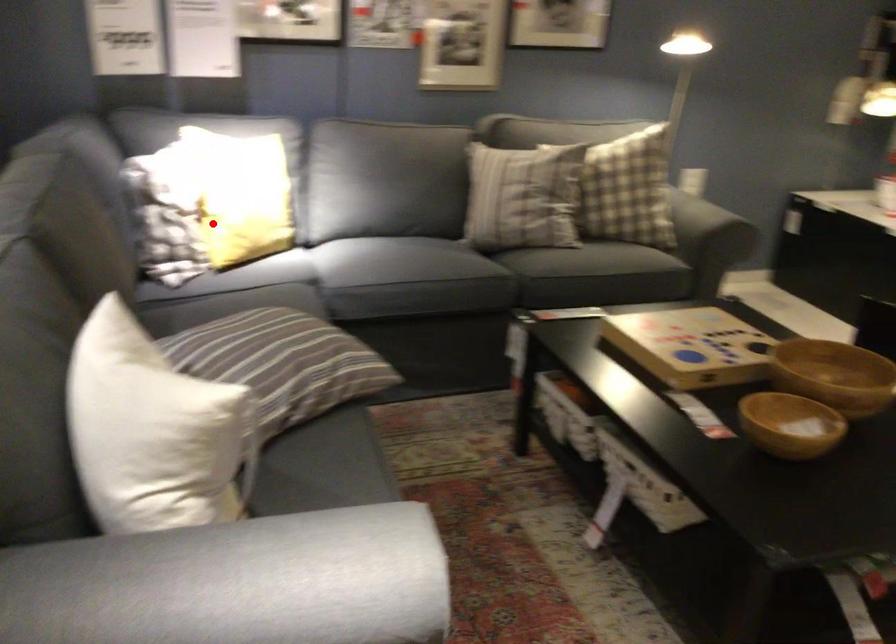
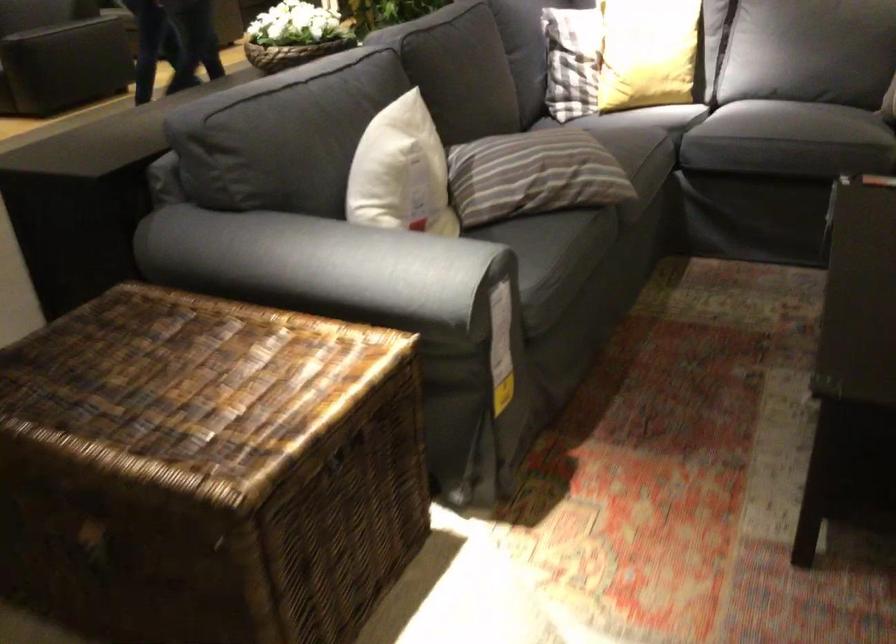
Question: A red point is marked in image1. In image2, is the corresponding 3D point closer to the camera or farther? Reply with the corresponding letter.

Choices:
 (A) The corresponding 3D point is closer.
 (B) The corresponding 3D point is farther.

Answer: (B)